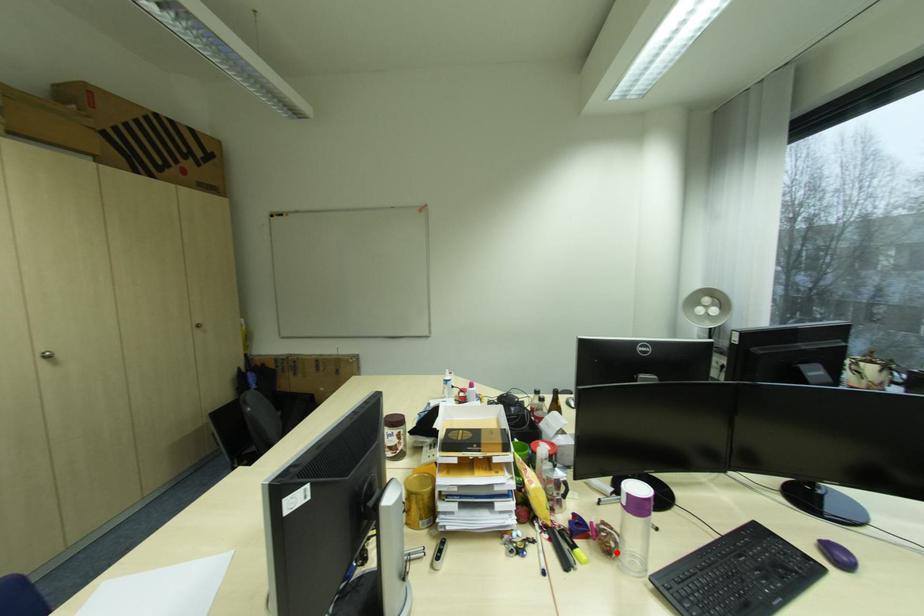
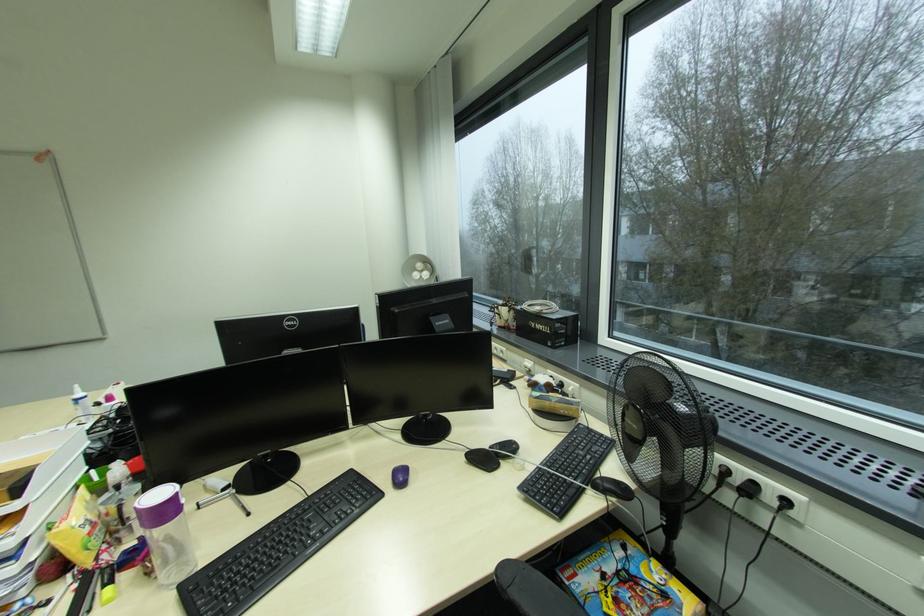
Find the pixel in the second image that matches the highlighted location in the first image.

(159, 573)